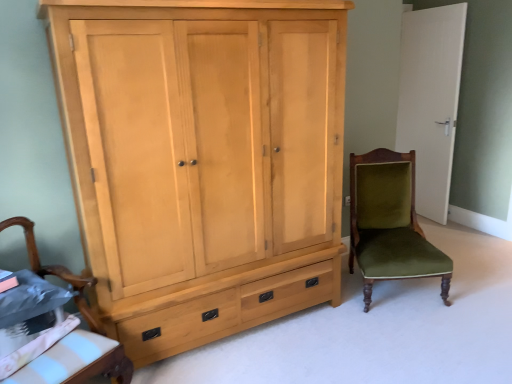
Question: Does wooden armchair at lower left, positioned as the 1th chair in front-to-back order, have a greater width compared to velvet green chair at right, the first chair when ordered from right to left?

Choices:
 (A) no
 (B) yes

Answer: (A)

Question: Is wooden armchair at lower left, placed as the 2th chair when sorted from back to front, thinner than velvet green chair at right, the first chair when ordered from right to left?

Choices:
 (A) no
 (B) yes

Answer: (B)

Question: Does wooden armchair at lower left, the 2th chair in the right-to-left sequence, have a larger size compared to velvet green chair at right, the 2th chair positioned from the front?

Choices:
 (A) no
 (B) yes

Answer: (A)

Question: Is wooden armchair at lower left, which is the first chair in left-to-right order, at the left side of velvet green chair at right, placed as the second chair when sorted from left to right?

Choices:
 (A) yes
 (B) no

Answer: (A)

Question: Does wooden armchair at lower left, placed as the 2th chair when sorted from back to front, lie in front of velvet green chair at right, the 1th chair positioned from the back?

Choices:
 (A) no
 (B) yes

Answer: (B)

Question: From the image's perspective, is wooden armchair at lower left, which is the first chair in left-to-right order, on top of velvet green chair at right, the 1th chair positioned from the back?

Choices:
 (A) yes
 (B) no

Answer: (B)

Question: Is white matte door at upper right outside wooden armchair at lower left, positioned as the 1th chair in front-to-back order?

Choices:
 (A) yes
 (B) no

Answer: (A)

Question: Can you confirm if white matte door at upper right is shorter than wooden armchair at lower left, the 2th chair in the right-to-left sequence?

Choices:
 (A) no
 (B) yes

Answer: (A)

Question: From the image's perspective, does white matte door at upper right appear higher than wooden armchair at lower left, which is the first chair in left-to-right order?

Choices:
 (A) no
 (B) yes

Answer: (B)

Question: Does white matte door at upper right have a greater width compared to wooden armchair at lower left, placed as the 2th chair when sorted from back to front?

Choices:
 (A) no
 (B) yes

Answer: (A)

Question: From a real-world perspective, does white matte door at upper right sit lower than wooden armchair at lower left, the 2th chair in the right-to-left sequence?

Choices:
 (A) yes
 (B) no

Answer: (B)

Question: From a real-world perspective, is white matte door at upper right over wooden armchair at lower left, positioned as the 1th chair in front-to-back order?

Choices:
 (A) yes
 (B) no

Answer: (A)

Question: From a real-world perspective, is white matte door at upper right located beneath velvet green chair at right, the 1th chair positioned from the back?

Choices:
 (A) yes
 (B) no

Answer: (B)